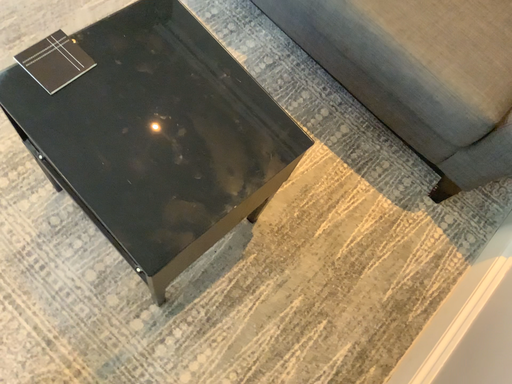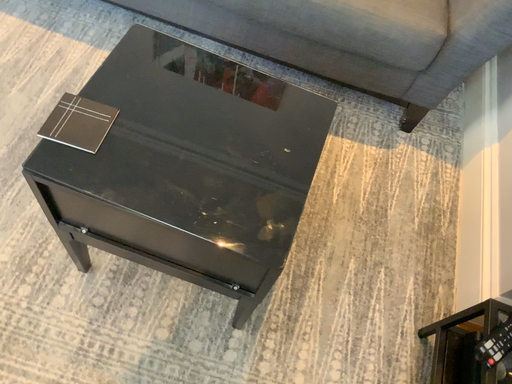
Question: How did the camera likely rotate when shooting the video?

Choices:
 (A) rotated right
 (B) rotated left

Answer: (A)